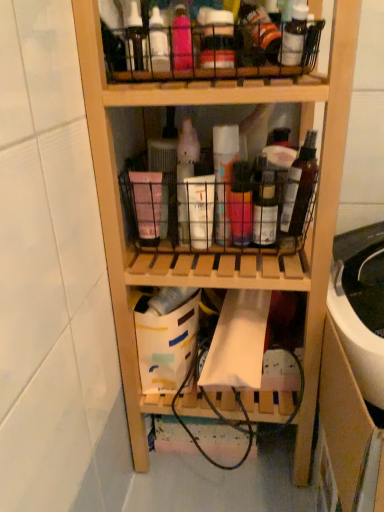
Question: Is translucent plastic spray can at center, acting as the fourth bottle starting from the right, positioned with its back to pink matte basket at center?

Choices:
 (A) yes
 (B) no

Answer: (B)

Question: Could you tell me if translucent plastic spray can at center, acting as the fourth bottle starting from the right, is facing pink matte basket at center?

Choices:
 (A) yes
 (B) no

Answer: (B)

Question: Is translucent plastic spray can at center, which is the first bottle in left-to-right order, outside pink matte basket at center?

Choices:
 (A) no
 (B) yes

Answer: (A)

Question: Is translucent plastic spray can at center, which is the first bottle in left-to-right order, positioned far away from pink matte basket at center?

Choices:
 (A) yes
 (B) no

Answer: (B)

Question: From the image's perspective, is translucent plastic spray can at center, acting as the fourth bottle starting from the right, below pink matte basket at center?

Choices:
 (A) yes
 (B) no

Answer: (B)

Question: Looking at the image, does pink matte basket at center seem bigger or smaller compared to metallic wire basket at upper center, the first shelf in the top-to-bottom sequence?

Choices:
 (A) big
 (B) small

Answer: (A)

Question: In the image, is pink matte basket at center positioned in front of or behind metallic wire basket at upper center, the first shelf in the top-to-bottom sequence?

Choices:
 (A) front
 (B) behind

Answer: (B)

Question: Considering the positions of pink matte basket at center and metallic wire basket at upper center, the first shelf in the top-to-bottom sequence, in the image, is pink matte basket at center wider or thinner than metallic wire basket at upper center, the first shelf in the top-to-bottom sequence,?

Choices:
 (A) wide
 (B) thin

Answer: (A)

Question: Choose the correct answer: Is pink matte basket at center inside metallic wire basket at upper center, the first shelf in the top-to-bottom sequence, or outside it?

Choices:
 (A) outside
 (B) inside

Answer: (A)

Question: Is wooden drawer at lower right in front of or behind wooden shelf at center, which ranks as the second shelf in top-to-bottom order, in the image?

Choices:
 (A) front
 (B) behind

Answer: (A)

Question: From a real-world perspective, is wooden drawer at lower right physically located above or below wooden shelf at center, which ranks as the second shelf in top-to-bottom order?

Choices:
 (A) above
 (B) below

Answer: (B)

Question: Is wooden drawer at lower right situated inside wooden shelf at center, placed as the 1th shelf when sorted from bottom to top, or outside?

Choices:
 (A) inside
 (B) outside

Answer: (B)

Question: Is point (324, 342) closer or farther from the camera than point (115, 290)?

Choices:
 (A) closer
 (B) farther

Answer: (A)

Question: In terms of width, does metallic wire basket at upper center, marked as the 2th shelf in a bottom-to-top arrangement, look wider or thinner when compared to translucent plastic spray can at center, which is the first bottle in left-to-right order?

Choices:
 (A) thin
 (B) wide

Answer: (B)

Question: From the image's perspective, is metallic wire basket at upper center, the first shelf in the top-to-bottom sequence, positioned above or below translucent plastic spray can at center, acting as the fourth bottle starting from the right?

Choices:
 (A) below
 (B) above

Answer: (B)